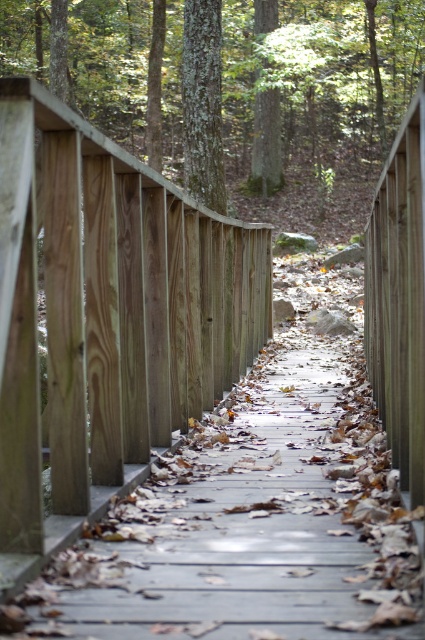
Question: Is smooth brown tree trunk at center below green lichen-covered tree trunk at center?

Choices:
 (A) no
 (B) yes

Answer: (A)

Question: Among these objects, which one is farthest from the camera?

Choices:
 (A) green mossy tree at center
 (B) green lichen-covered tree trunk at center
 (C) smooth brown tree trunk at center

Answer: (A)

Question: Does smooth brown tree trunk at center have a lesser width compared to green lichen-covered tree trunk at center?

Choices:
 (A) no
 (B) yes

Answer: (A)

Question: In this image, where is wooden fence at center located relative to smooth brown tree trunk at center?

Choices:
 (A) below
 (B) above

Answer: (A)

Question: Among these points, which one is nearest to the camera?

Choices:
 (A) (127, 362)
 (B) (210, 60)

Answer: (A)

Question: Estimate the real-world distances between objects in this image. Which object is farther from the smooth brown tree trunk at center?

Choices:
 (A) wooden fence at center
 (B) green mossy tree at center
 (C) green lichen-covered tree trunk at center

Answer: (A)